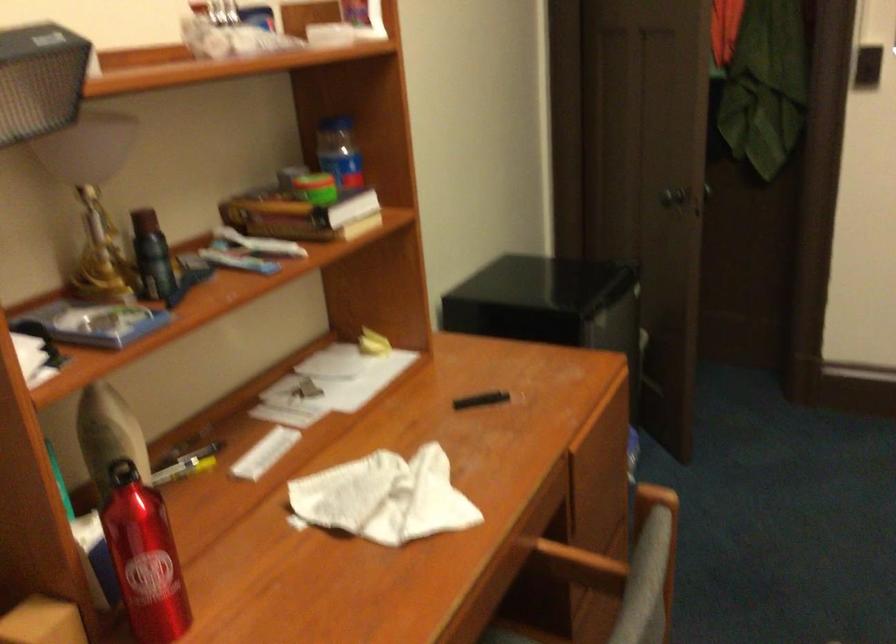
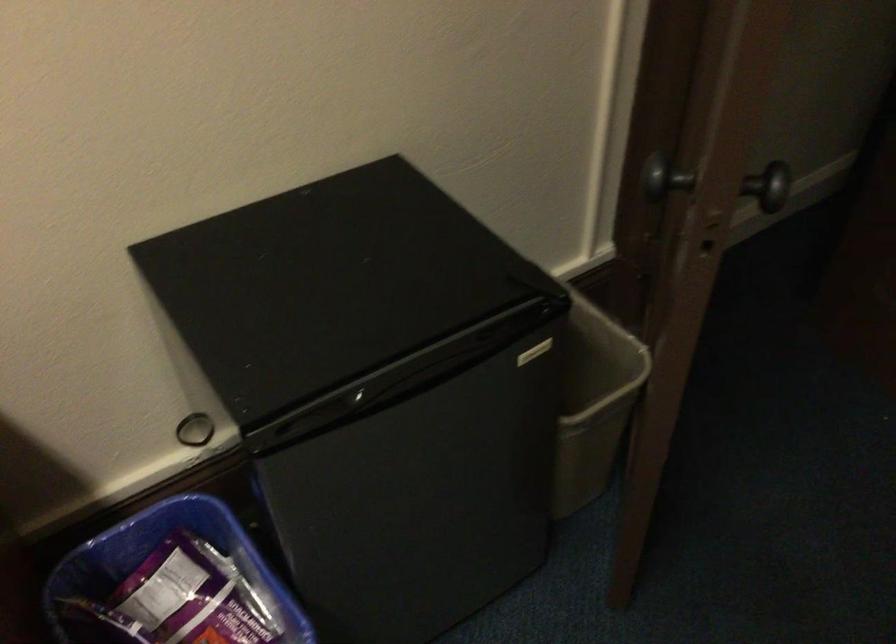
In the second image, find the point that corresponds to point (709, 185) in the first image.

(771, 185)